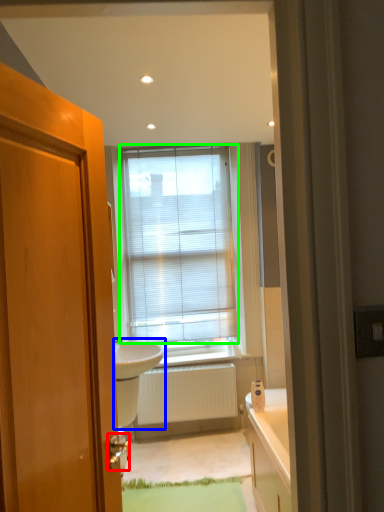
Question: Which object is the closest to the door handle (highlighted by a red box)? Choose among these: sink (highlighted by a blue box) or window blind (highlighted by a green box).

Choices:
 (A) sink
 (B) window blind

Answer: (A)